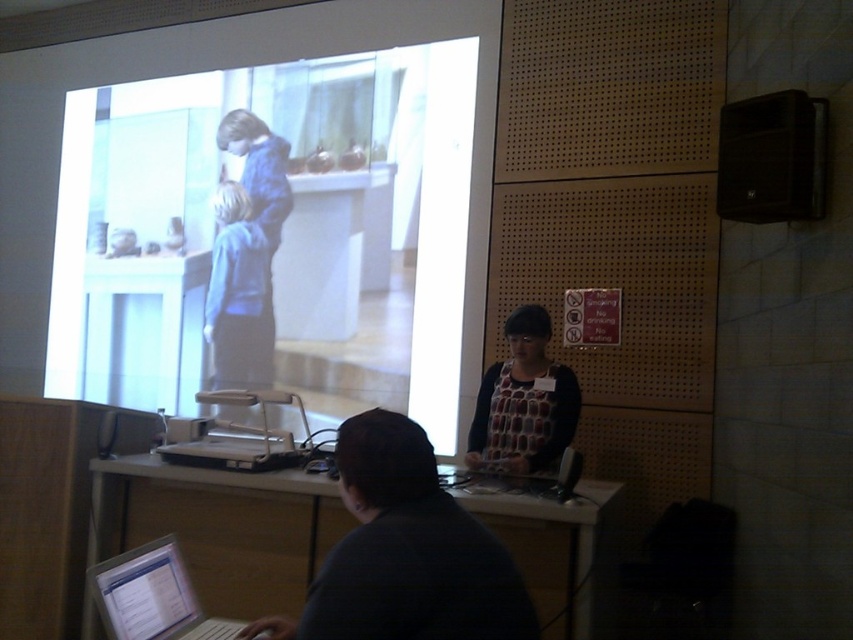
Question: Which of these objects is positioned farthest from the white glossy table at lower center?

Choices:
 (A) polka dot blouse at center
 (B) silver metallic laptop at lower left

Answer: (A)

Question: Is white glossy table at lower center to the right of silver metallic laptop at lower left from the viewer's perspective?

Choices:
 (A) no
 (B) yes

Answer: (A)

Question: Which point is closer to the camera?

Choices:
 (A) white glossy screen at upper center
 (B) white glossy table at lower center

Answer: (B)

Question: Is white glossy screen at upper center below polka dot blouse at center?

Choices:
 (A) no
 (B) yes

Answer: (A)

Question: Is white glossy screen at upper center above polka dot blouse at center?

Choices:
 (A) yes
 (B) no

Answer: (A)

Question: Considering the real-world distances, which object is farthest from the polka dot blouse at center?

Choices:
 (A) white glossy table at lower center
 (B) white glossy screen at upper center
 (C) silver metallic laptop at lower left

Answer: (C)